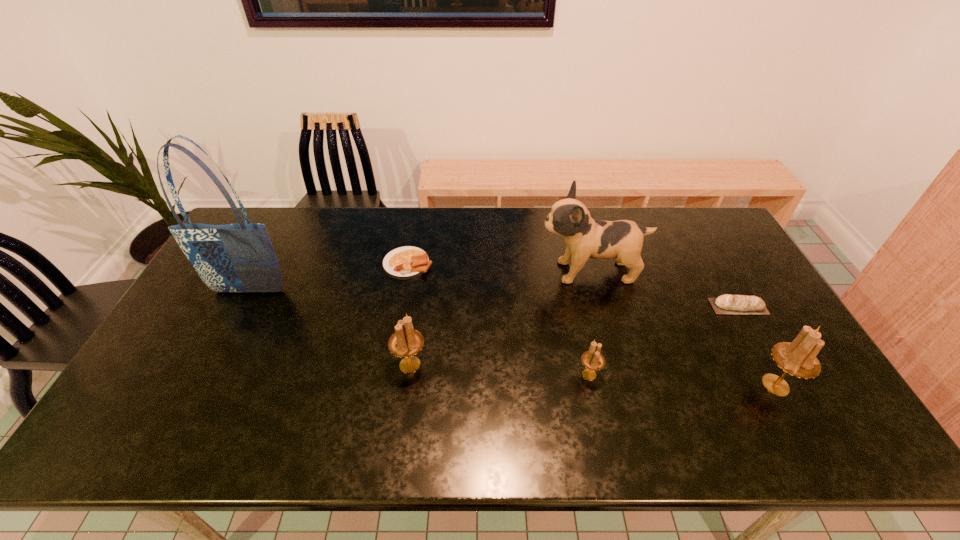
Identify the location of candle holder that is the closest to the pita bread. (798, 358).

Choose which candle holder is the third nearest neighbor to the fourth nearest object. Please provide its 2D coordinates. Your answer should be formatted as a tuple, i.e. [(x, y)], where the tuple contains the x and y coordinates of a point satisfying the conditions above.

[(405, 342)]

Locate an element on the screen. vacant area that satisfies the following two spatial constraints: 1. on the front-facing side of the tallest object; 2. on the right side of the second shortest candle holder is located at coordinates (211, 364).

Where is `vacant area in the image that satisfies the following two spatial constraints: 1. at the face of the puppy; 2. on the left side of the pita bread`? vacant area in the image that satisfies the following two spatial constraints: 1. at the face of the puppy; 2. on the left side of the pita bread is located at coordinates (600, 306).

Locate an element on the screen. The width and height of the screenshot is (960, 540). free location that satisfies the following two spatial constraints: 1. at the face of the second tallest object; 2. on the front-facing side of the leftmost object is located at coordinates (596, 292).

At what (x,y) coordinates should I click in order to perform the action: click on vacant space that satisfies the following two spatial constraints: 1. at the face of the rightmost candle holder; 2. on the right side of the puppy. Please return your answer as a coordinate pair (x, y). This screenshot has width=960, height=540. Looking at the image, I should click on (620, 385).

Where is `vacant region that satisfies the following two spatial constraints: 1. on the front side of the rightmost candle holder; 2. on the left side of the second shortest candle holder`? The width and height of the screenshot is (960, 540). vacant region that satisfies the following two spatial constraints: 1. on the front side of the rightmost candle holder; 2. on the left side of the second shortest candle holder is located at coordinates (407, 385).